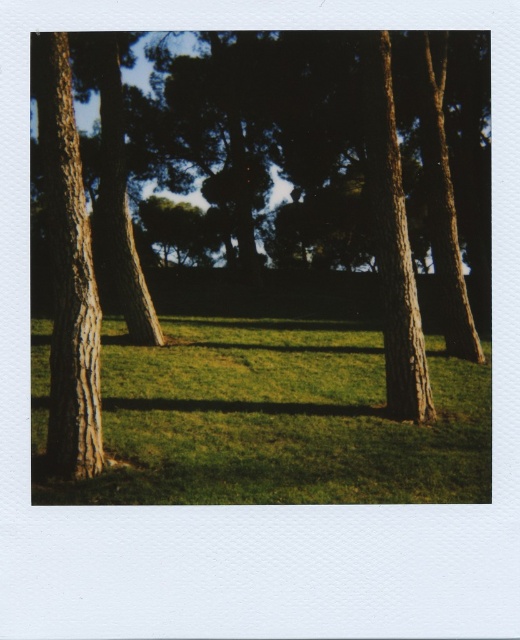
Question: Does smooth brown tree trunk at left have a greater width compared to brown rough tree trunk at right?

Choices:
 (A) yes
 (B) no

Answer: (A)

Question: Among these objects, which one is farthest from the camera?

Choices:
 (A) smooth brown tree trunk at left
 (B) brown rough tree trunk at right
 (C) green grass at center

Answer: (B)

Question: Can you confirm if smooth brown tree trunk at left is positioned to the right of smooth brown tree trunk at right?

Choices:
 (A) no
 (B) yes

Answer: (A)

Question: Considering the real-world distances, which object is farthest from the green grass at center?

Choices:
 (A) brown rough bark tree at center
 (B) smooth brown tree trunk at left
 (C) smooth brown tree trunk at right

Answer: (B)

Question: Based on their relative distances, which object is farther from the brown rough bark tree at center?

Choices:
 (A) brown rough tree trunk at right
 (B) smooth brown tree trunk at right
 (C) smooth brown tree trunk at left

Answer: (C)

Question: Is smooth brown tree trunk at right thinner than brown rough tree trunk at right?

Choices:
 (A) yes
 (B) no

Answer: (B)